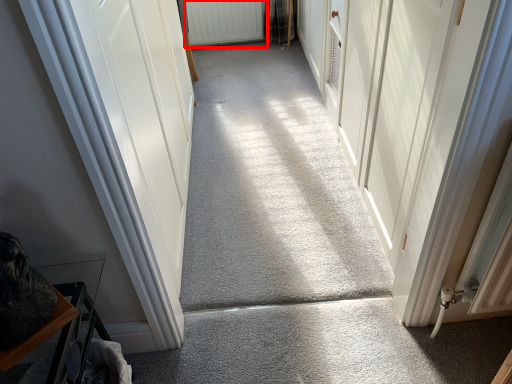
Question: In this image, where is radiator (annotated by the red box) located relative to concrete?

Choices:
 (A) right
 (B) left

Answer: (B)